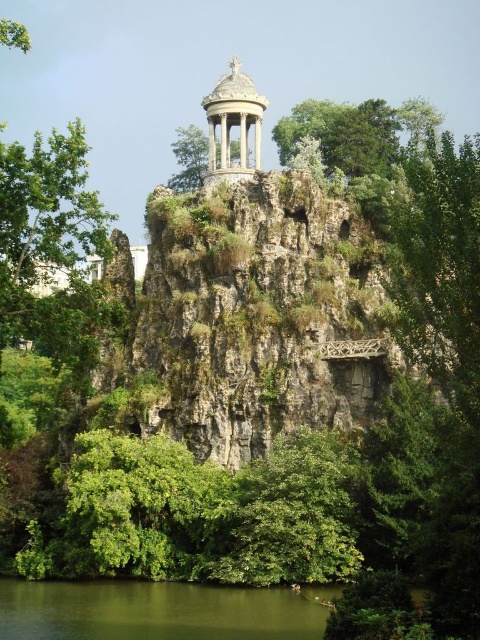
Can you confirm if green leafy tree at upper center is positioned to the left of matte stone gazebo at upper center?

Incorrect, green leafy tree at upper center is not on the left side of matte stone gazebo at upper center.

Is green leafy tree at upper center shorter than matte stone gazebo at upper center?

No.

Is point (371, 147) positioned after point (261, 136)?

No, it is in front of (261, 136).

The image size is (480, 640). Find the location of `green leafy tree at upper center`. green leafy tree at upper center is located at coordinates (343, 134).

Does point (96, 580) come closer to viewer compared to point (315, 116)?

Yes, it is.

Does green liquid water at lower center appear over green leafy tree at upper center?

Incorrect, green liquid water at lower center is not positioned above green leafy tree at upper center.

Between point (38, 637) and point (337, 156), which one is positioned behind?

Point (337, 156)

Locate an element on the screen. Image resolution: width=480 pixels, height=640 pixels. green liquid water at lower center is located at coordinates (158, 611).

Who is lower down, green liquid water at lower center or matte stone gazebo at upper center?

Positioned lower is green liquid water at lower center.

Who is taller, green liquid water at lower center or matte stone gazebo at upper center?

Standing taller between the two is matte stone gazebo at upper center.

Is point (90, 621) farther from camera compared to point (224, 84)?

No, it is not.

You are a GUI agent. You are given a task and a screenshot of the screen. Output one action in this format:
    pyautogui.click(x=<x>, y=<y>)
    Task: Click on the green liquid water at lower center
    The width and height of the screenshot is (480, 640).
    Given the screenshot: What is the action you would take?
    pyautogui.click(x=158, y=611)